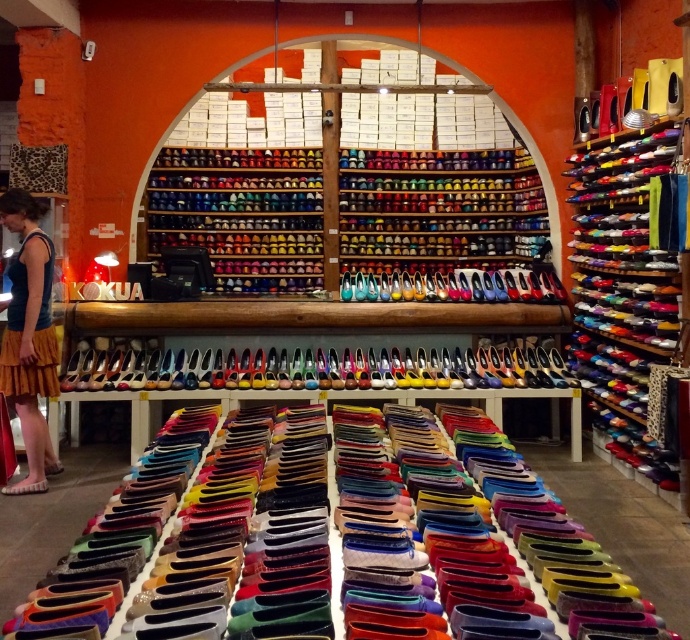
Looking at this image, is yellow textured skirt at lower left to the right of wooden table at center from the viewer's perspective?

In fact, yellow textured skirt at lower left is to the left of wooden table at center.

Who is positioned more to the right, yellow textured skirt at lower left or wooden table at center?

From the viewer's perspective, wooden table at center appears more on the right side.

Where is `yellow textured skirt at lower left`? The image size is (690, 640). yellow textured skirt at lower left is located at coordinates (29, 337).

Identify the location of yellow textured skirt at lower left. (29, 337).